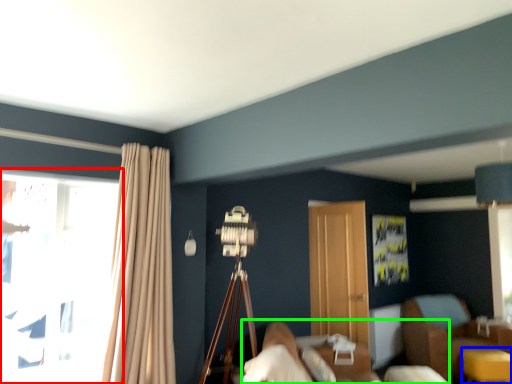
Question: Considering the real-world distances, which object is closest to window (highlighted by a red box)? table (highlighted by a blue box) or bed (highlighted by a green box).

Choices:
 (A) table
 (B) bed

Answer: (B)